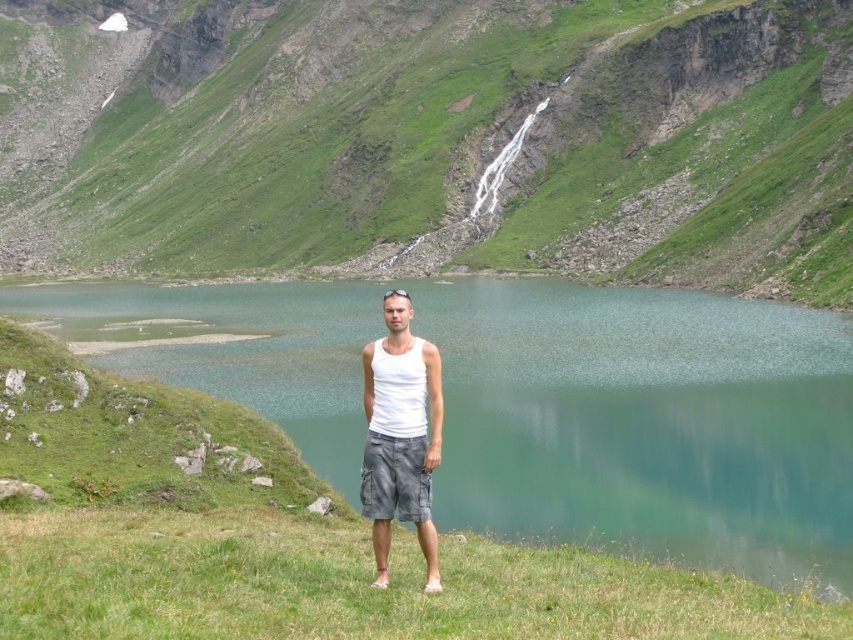
Which is behind, point (503, 500) or point (392, 502)?

Point (503, 500)

Consider the image. How far apart are green smooth water at center and gray cotton shorts at center?

green smooth water at center and gray cotton shorts at center are 44.79 meters apart from each other.

Is point (456, 378) farther from camera compared to point (370, 497)?

That is True.

At what (x,y) coordinates should I click in order to perform the action: click on green smooth water at center. Please return your answer as a coordinate pair (x, y). This screenshot has height=640, width=853. Looking at the image, I should click on (646, 422).

Which is above, green smooth water at center or white cotton tank top at center?

green smooth water at center is higher up.

You are a GUI agent. You are given a task and a screenshot of the screen. Output one action in this format:
    pyautogui.click(x=<x>, y=<y>)
    Task: Click on the green smooth water at center
    The height and width of the screenshot is (640, 853).
    Given the screenshot: What is the action you would take?
    pyautogui.click(x=646, y=422)

I want to click on green smooth water at center, so click(646, 422).

Which is above, green grassy hillside at center or gray cotton shorts at center?

green grassy hillside at center is above.

Which of these two, green grassy hillside at center or gray cotton shorts at center, stands shorter?

gray cotton shorts at center

What do you see at coordinates (432, 138) in the screenshot? I see `green grassy hillside at center` at bounding box center [432, 138].

The width and height of the screenshot is (853, 640). What are the coordinates of `green grassy hillside at center` in the screenshot? It's located at (432, 138).